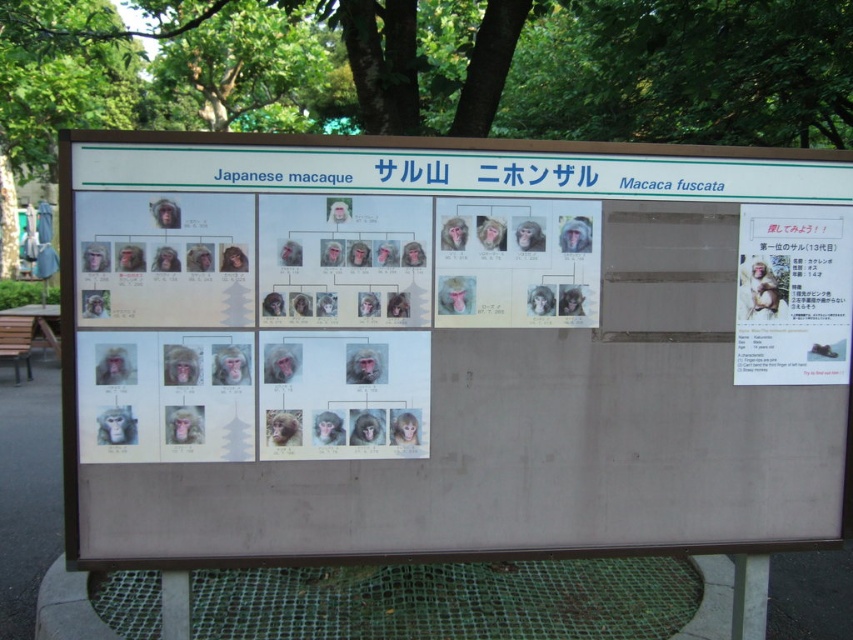
Question: Does white paper at center appear over matte paper poster at upper right?

Choices:
 (A) yes
 (B) no

Answer: (B)

Question: Can you confirm if white paper at center is positioned below matte paper poster at upper right?

Choices:
 (A) no
 (B) yes

Answer: (B)

Question: Does white paper at center have a lesser width compared to matte paper poster at upper right?

Choices:
 (A) no
 (B) yes

Answer: (A)

Question: Which point is farther from the camera taking this photo?

Choices:
 (A) (186, 148)
 (B) (827, 378)

Answer: (B)

Question: Which point appears farthest from the camera in this image?

Choices:
 (A) (763, 289)
 (B) (398, 499)

Answer: (A)